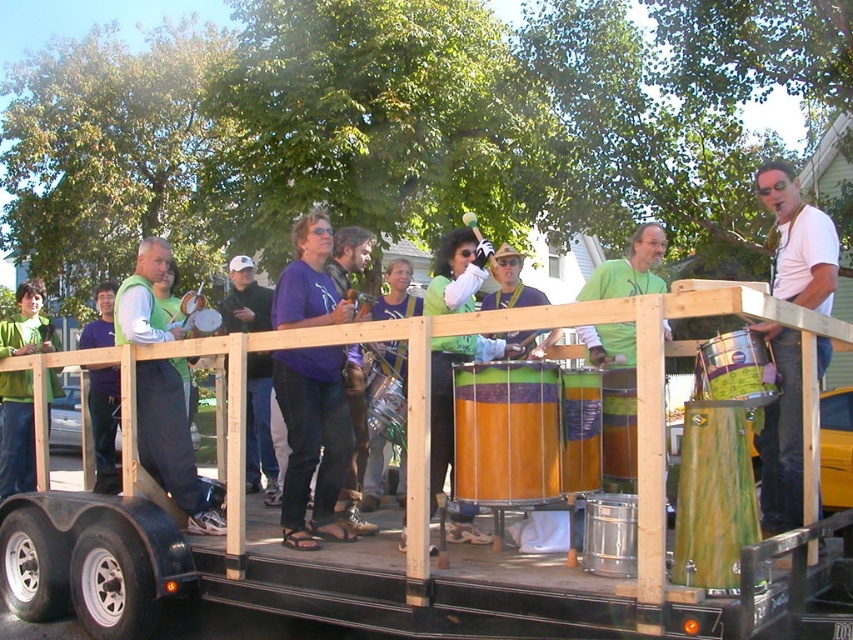
You are a participant in the parade and need to locate your green matte vest at left and the green matte drum at center. From the perspective of someone standing on the float facing forward, which object is closer to your left side?

The green matte vest at left is positioned on the left side of the green matte drum at center, so from the perspective of someone facing forward on the float, the green matte vest at left is closer to your left side.

You are a photographer trying to capture a clear photo of both the green matte jacket at left and the purple matte shirt at center. Since you want to focus on the clothing items, which one should you adjust your camera settings to prioritize for sharpness?

The green matte jacket at left is thinner than the purple matte shirt at center, so you should prioritize focusing on the green matte jacket at left to ensure its details are captured clearly.

You are a photographer at the parade trying to capture a clear photo of both the green matte jacket at left and the purple matte shirt at center. Since you want both subjects in focus, which one should you focus on first to ensure the other is also in the frame?

The green matte jacket at left is located below the purple matte shirt at center, so focusing on the purple matte shirt at center first will ensure the green matte jacket at left is also in focus due to its lower position.